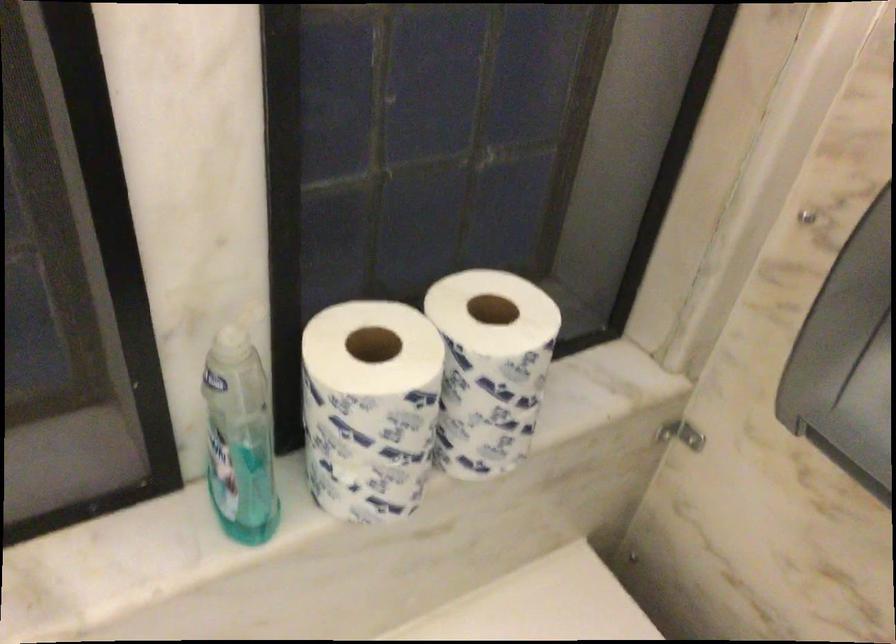
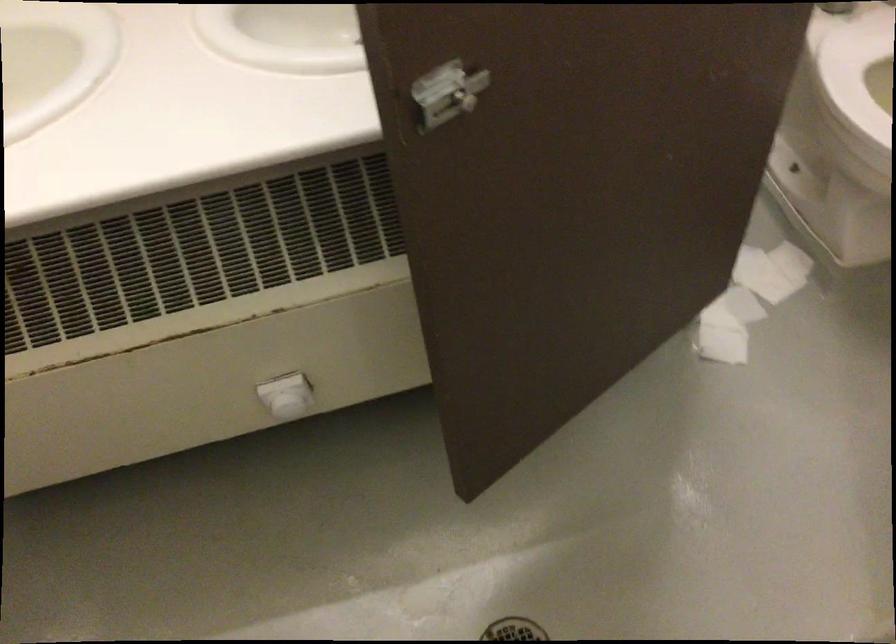
In a continuous first-person perspective shot, in which direction is the camera moving?

The cameraman moved toward right, backward.